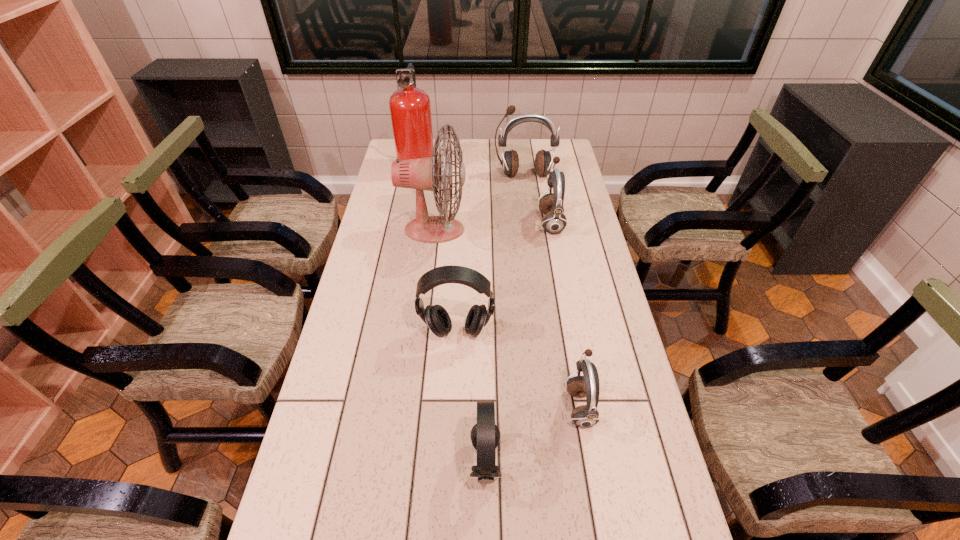
Find the location of a particular element. The image size is (960, 540). fire extinguisher is located at coordinates (410, 109).

Locate an element on the screen. The height and width of the screenshot is (540, 960). fan is located at coordinates (421, 174).

Locate an element on the screen. Image resolution: width=960 pixels, height=540 pixels. the farthest brown earphone is located at coordinates (510, 163).

The image size is (960, 540). I want to click on the biggest brown earphone, so click(510, 163).

Where is `the bigger black earphone`? The width and height of the screenshot is (960, 540). the bigger black earphone is located at coordinates coord(438,320).

Locate an element on the screen. the third nearest earphone is located at coordinates (438, 320).

The width and height of the screenshot is (960, 540). In order to click on the second farthest earphone in this screenshot , I will do `click(554, 221)`.

This screenshot has height=540, width=960. In order to click on the second farthest brown earphone in this screenshot , I will do `click(554, 221)`.

This screenshot has height=540, width=960. I want to click on the smallest brown earphone, so click(x=584, y=416).

Where is `the nearer black earphone`? the nearer black earphone is located at coordinates (485, 435).